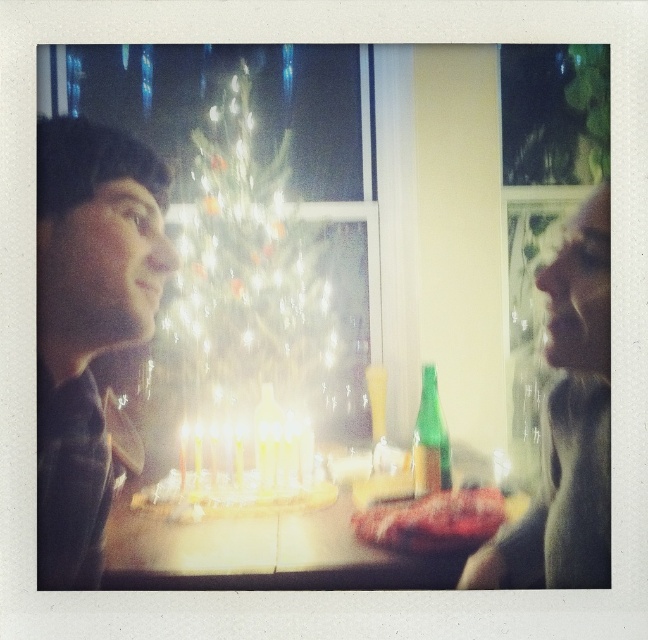
Question: Can you confirm if smooth skin face at right is positioned above white glossy table at center?

Choices:
 (A) no
 (B) yes

Answer: (B)

Question: Is the position of smooth skin face at right more distant than that of green glass bottle at center?

Choices:
 (A) no
 (B) yes

Answer: (A)

Question: Can you confirm if illuminated glass christmas tree at center is wider than smooth skin face at right?

Choices:
 (A) yes
 (B) no

Answer: (A)

Question: Which point is farther from the camera taking this photo?

Choices:
 (A) (x=588, y=428)
 (B) (x=424, y=371)

Answer: (B)

Question: Among these points, which one is farthest from the camera?

Choices:
 (A) (124, 564)
 (B) (422, 408)

Answer: (B)

Question: Which of the following is the farthest from the observer?

Choices:
 (A) white glossy table at center
 (B) green glass bottle at center
 (C) smooth skin face at right

Answer: (B)